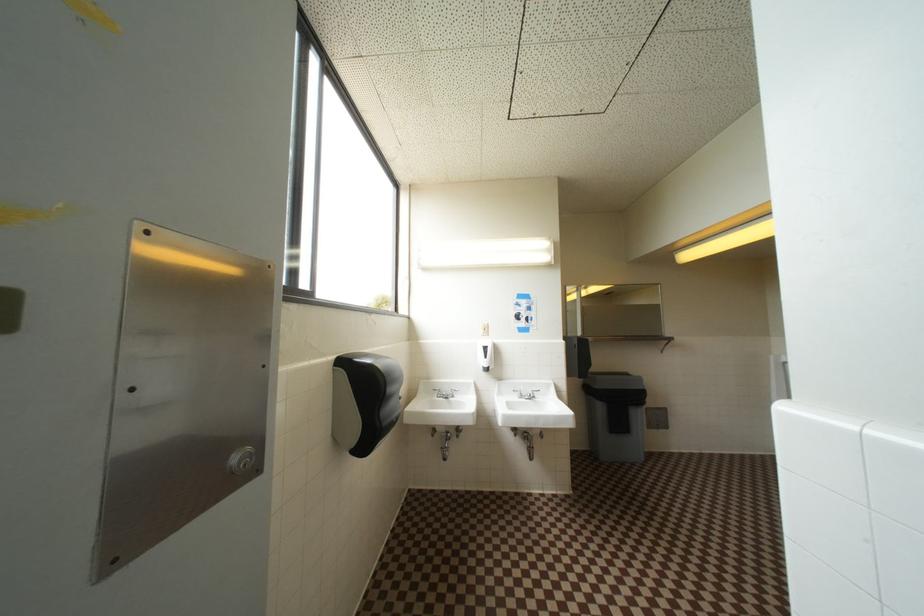
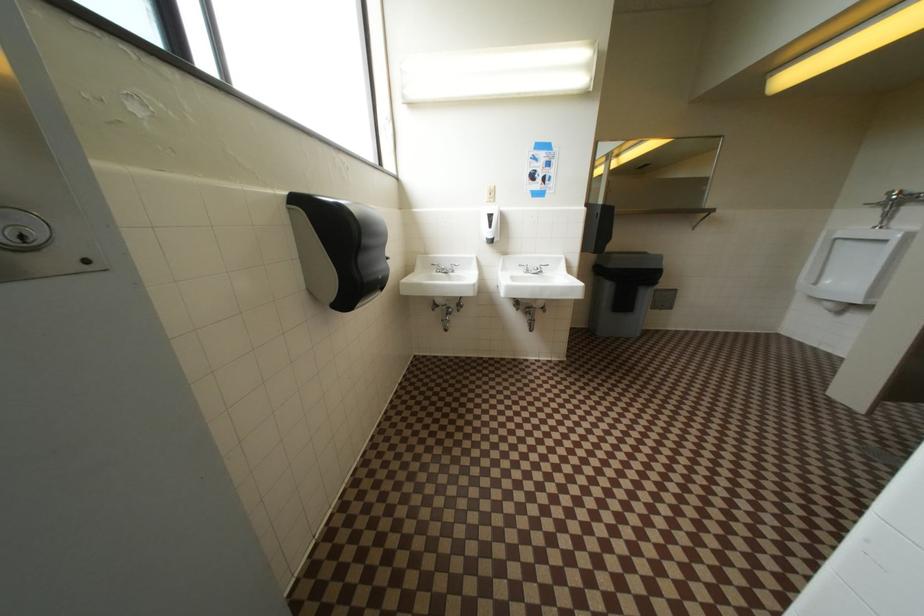
Question: The images are taken continuously from a first-person perspective. In which direction are you moving?

Choices:
 (A) Left
 (B) Right
 (C) Forward
 (D) Backward

Answer: (C)